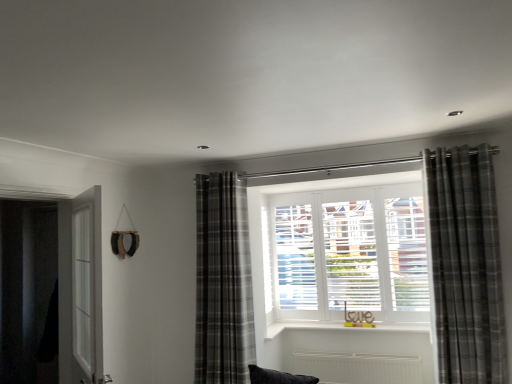
Question: Is clear glass screen door at left inside or outside of gray plaid curtain at right, which ranks as the 1th curtain in right-to-left order?

Choices:
 (A) inside
 (B) outside

Answer: (B)

Question: From the image's perspective, relative to gray plaid curtain at right, which ranks as the 1th curtain in right-to-left order, is clear glass screen door at left above or below?

Choices:
 (A) below
 (B) above

Answer: (A)

Question: Which of these objects is positioned farthest from the clear glass screen door at left?

Choices:
 (A) black matte door at left
 (B) gray plaid curtain at center, positioned as the second curtain in right-to-left order
 (C) gray plaid curtain at right, which ranks as the 1th curtain in right-to-left order

Answer: (C)

Question: Estimate the real-world distances between objects in this image. Which object is closer to the clear glass screen door at left?

Choices:
 (A) black matte door at left
 (B) gray plaid curtain at right, which ranks as the 1th curtain in right-to-left order
 (C) gray plaid curtain at center, which ranks as the 1th curtain in back-to-front order

Answer: (A)